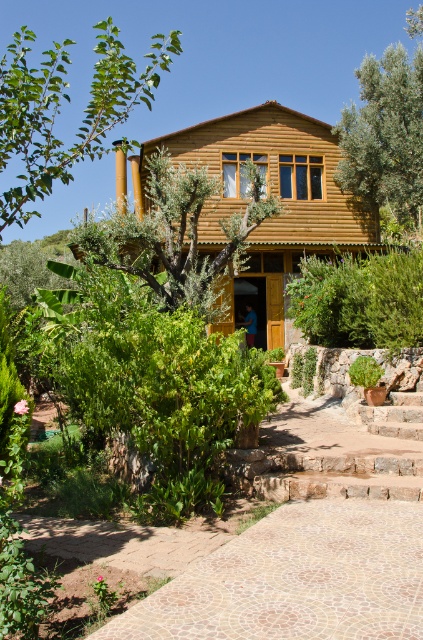
Does mosaic stone path at lower center have a larger size compared to green leafy tree at center?

Correct, mosaic stone path at lower center is larger in size than green leafy tree at center.

What do you see at coordinates (296, 579) in the screenshot? The image size is (423, 640). I see `mosaic stone path at lower center` at bounding box center [296, 579].

Identify the location of mosaic stone path at lower center. (296, 579).

Is green leafy tree at upper left bigger than green leafy tree at upper right?

Correct, green leafy tree at upper left is larger in size than green leafy tree at upper right.

Find the location of a particular element. The width and height of the screenshot is (423, 640). green leafy tree at upper left is located at coordinates (60, 106).

The width and height of the screenshot is (423, 640). In order to click on green leafy tree at upper left in this screenshot , I will do `click(60, 106)`.

Who is more forward, (136,236) or (422,182)?

Positioned in front is point (136,236).

Is point (195, 168) closer to camera compared to point (386, 122)?

Yes, point (195, 168) is closer to viewer.

The image size is (423, 640). What are the coordinates of `green leafy tree at center` in the screenshot? It's located at (175, 234).